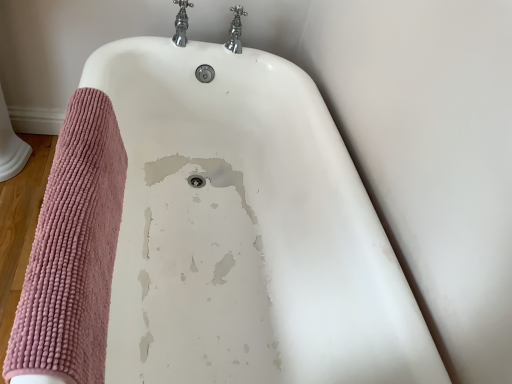
Question: Is chrome metallic faucet at upper center, positioned as the 1th tap in left-to-right order, in front of or behind chrome metallic faucet at upper center, acting as the first tap starting from the right, in the image?

Choices:
 (A) behind
 (B) front

Answer: (B)

Question: From the image's perspective, is chrome metallic faucet at upper center, which is the second tap in right-to-left order, positioned above or below chrome metallic faucet at upper center, acting as the first tap starting from the right?

Choices:
 (A) below
 (B) above

Answer: (B)

Question: Which of these objects is positioned farthest from the chrome metallic faucet at upper center, acting as the first tap starting from the right?

Choices:
 (A) chrome metallic faucet at upper center, positioned as the 1th tap in left-to-right order
 (B) white glossy bathtub at center
 (C) pink chenille bath towel at left

Answer: (C)

Question: Estimate the real-world distances between objects in this image. Which object is closer to the chrome metallic faucet at upper center, acting as the first tap starting from the right?

Choices:
 (A) chrome metallic faucet at upper center, which is the second tap in right-to-left order
 (B) pink chenille bath towel at left
 (C) white glossy bathtub at center

Answer: (A)